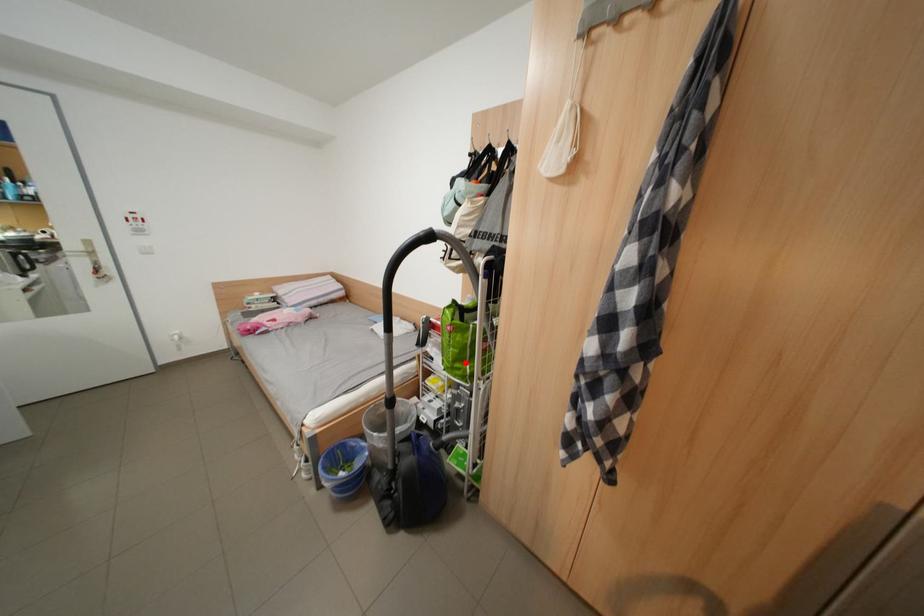
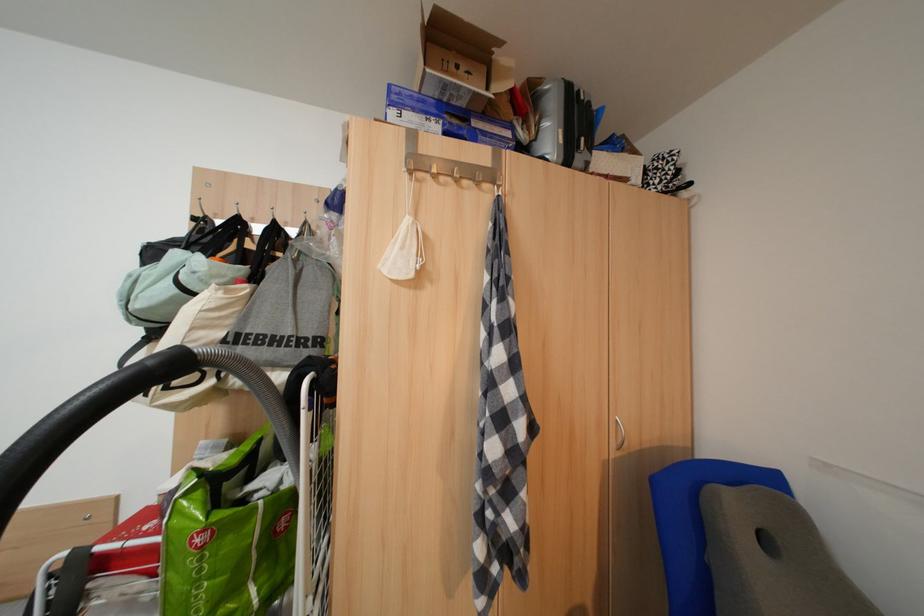
In the second image, find the point that corresponds to the highlighted location in the first image.

(225, 610)